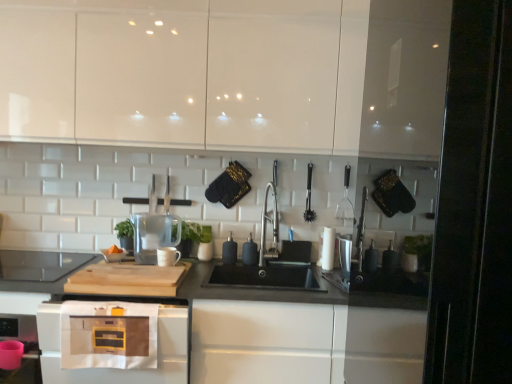
Question: Considering the positions of point (309, 205) and point (407, 329), is point (309, 205) closer or farther from the camera than point (407, 329)?

Choices:
 (A) closer
 (B) farther

Answer: (B)

Question: Considering the positions of black rubber brush at center, placed as the 2th appliance when sorted from right to left, and black matte countertop at center in the image, is black rubber brush at center, placed as the 2th appliance when sorted from right to left, taller or shorter than black matte countertop at center?

Choices:
 (A) short
 (B) tall

Answer: (A)

Question: Which object is the farthest from the black matte countertop at center?

Choices:
 (A) transparent glass pitcher at center, the sixth appliance when ordered from right to left
 (B) satin nickel faucet at center
 (C) natural wood cutting board at center
 (D) white glossy mug at center, positioned as the fifth appliance in right-to-left order
 (E) matte black cooktop at left

Answer: (B)

Question: Considering the real-world distances, which object is farthest from the matte black cooktop at left?

Choices:
 (A) white glossy mug at center, arranged as the second appliance when viewed from the left
 (B) glossy white cabinets at upper center
 (C) matte white microwave at lower left
 (D) natural wood cutting board at center
 (E) black rubber brush at center, placed as the 2th appliance when sorted from right to left

Answer: (E)